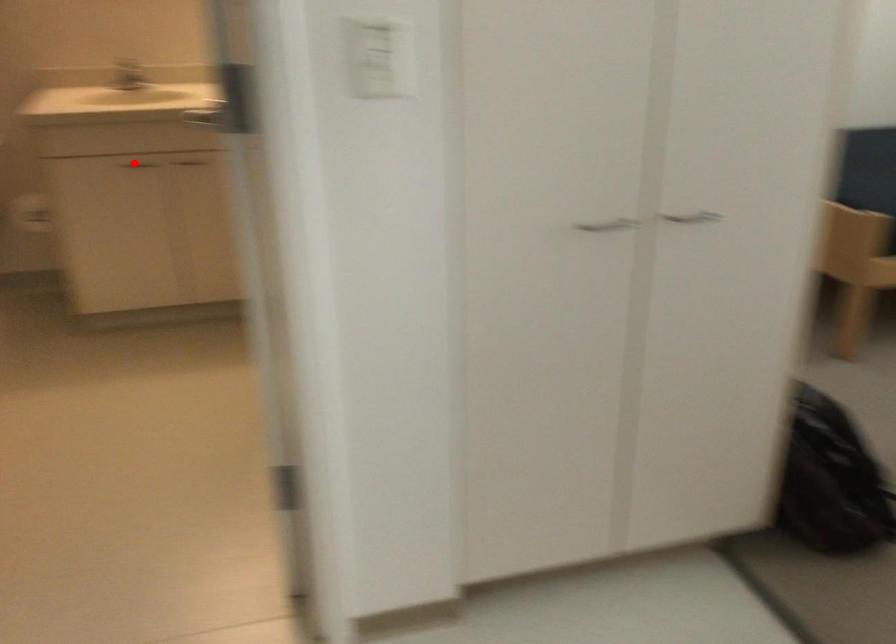
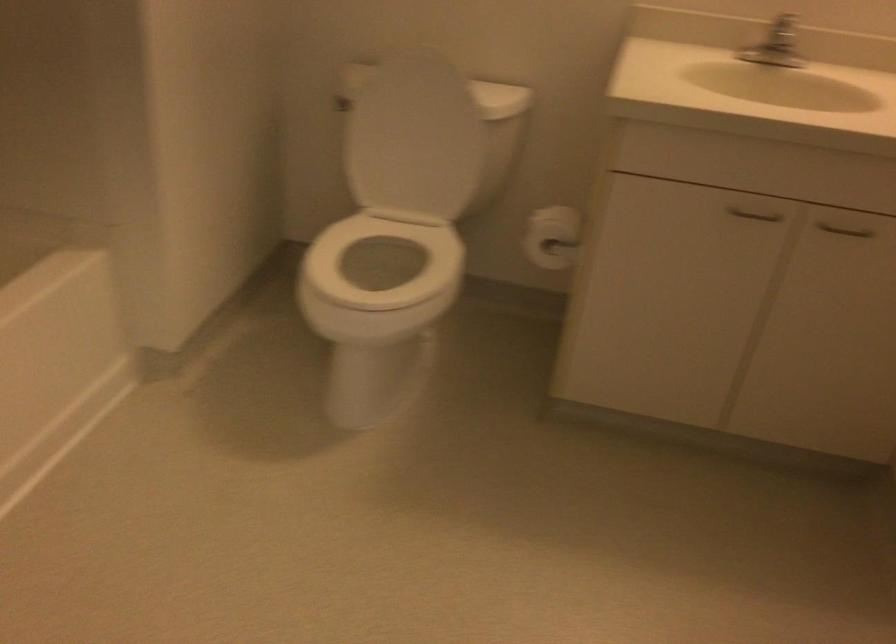
Question: I am providing you with two images of the same scene from different viewpoints. A red point is shown in image1. For the corresponding object point in image2, is it positioned nearer or farther from the camera?

Choices:
 (A) Nearer
 (B) Farther

Answer: (A)